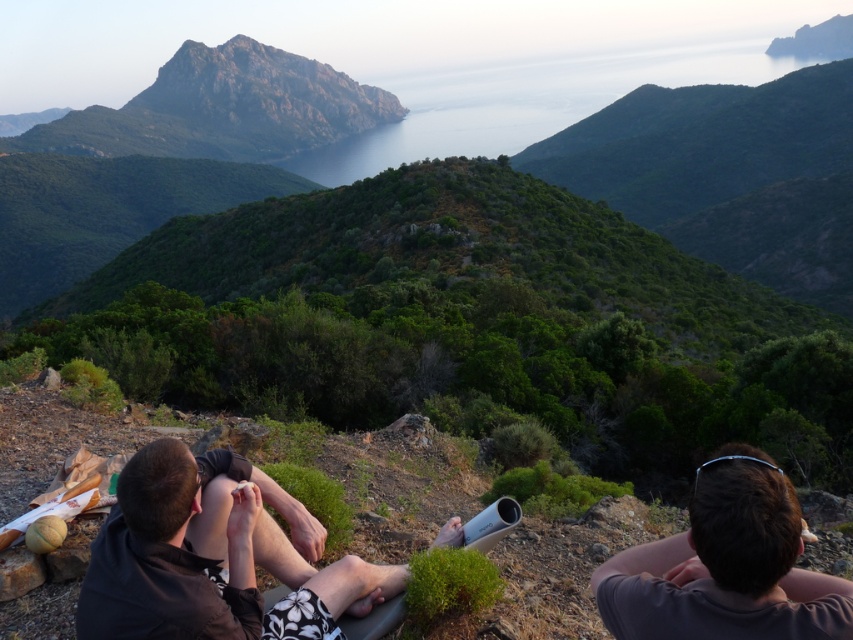
Question: Among these objects, which one is nearest to the camera?

Choices:
 (A) rugged stone peak at upper center
 (B) dark brown leather jacket at lower left
 (C) brown hair at center

Answer: (C)

Question: Which of the following is the closest to the observer?

Choices:
 (A) rugged stone peak at upper center
 (B) brown hair at center

Answer: (B)

Question: In this image, where is brown hair at center located relative to rugged stone peak at upper center?

Choices:
 (A) above
 (B) below

Answer: (B)

Question: Is dark brown leather jacket at lower left wider than rugged stone peak at upper center?

Choices:
 (A) yes
 (B) no

Answer: (B)

Question: Which of the following is the farthest from the observer?

Choices:
 (A) rugged stone peak at upper center
 (B) brown hair at center

Answer: (A)

Question: Is brown hair at center to the left of rugged stone peak at upper center from the viewer's perspective?

Choices:
 (A) no
 (B) yes

Answer: (A)